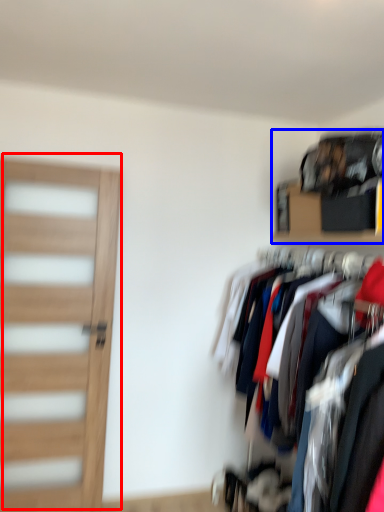
Question: Which point is closer to the camera, door (highlighted by a red box) or shelf (highlighted by a blue box)?

Choices:
 (A) door
 (B) shelf

Answer: (B)